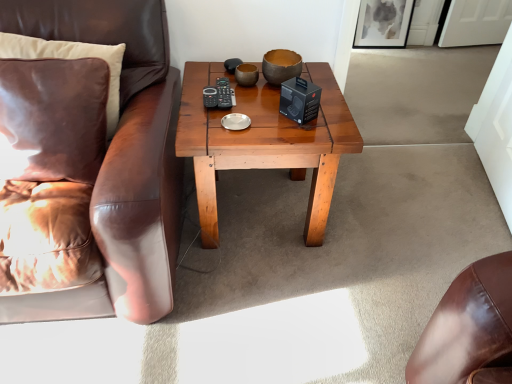
You are a GUI agent. You are given a task and a screenshot of the screen. Output one action in this format:
    pyautogui.click(x=<x>, y=<y>)
    Task: Click on the vacant area that is in front of matte gray painting at upper right
    The height and width of the screenshot is (384, 512).
    Given the screenshot: What is the action you would take?
    pyautogui.click(x=385, y=63)